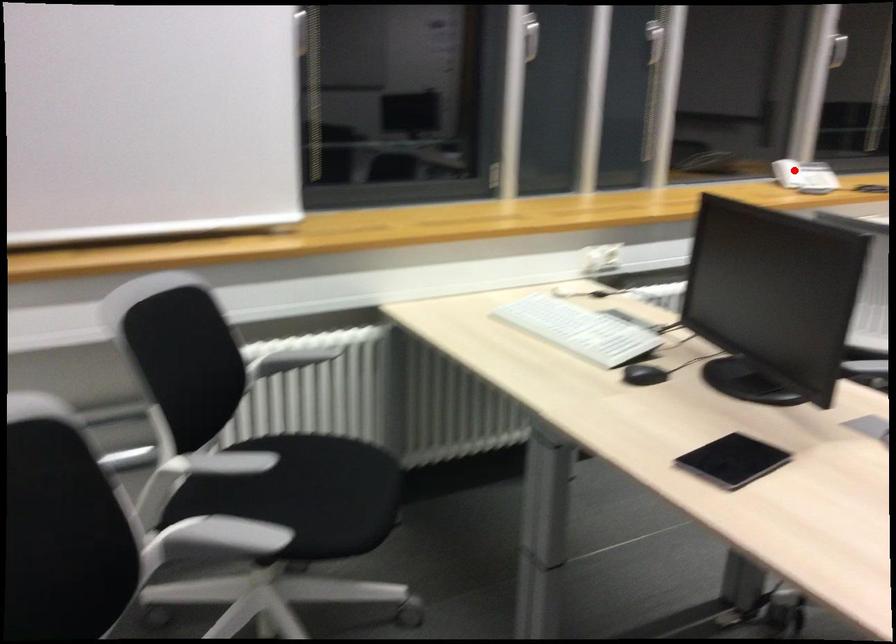
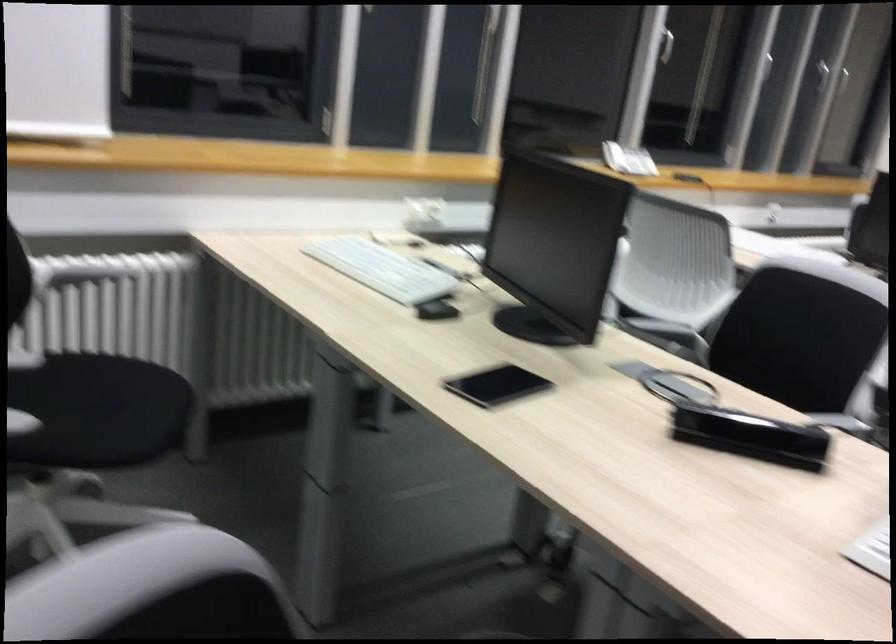
Question: I am providing you with two images of the same scene from different viewpoints. A red point is marked on the first image. Is the red point's position out of view in image 2?

Choices:
 (A) Yes
 (B) No

Answer: (B)